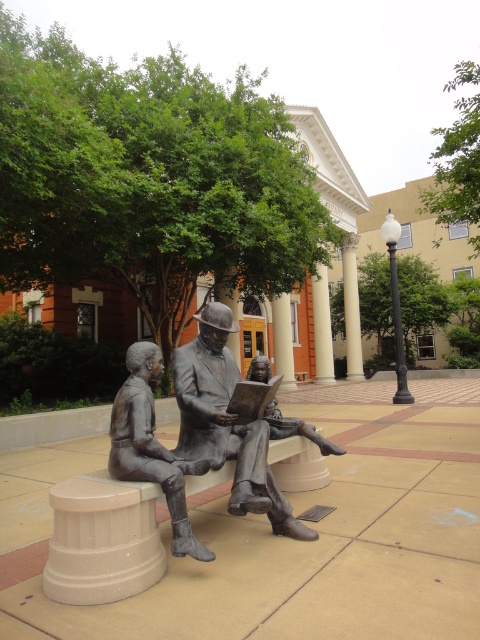
Is bronze statue of man reading at center bigger than bronze statue of man reading book at center?

Yes.

Is bronze statue of man reading at center positioned behind bronze statue of man reading book at center?

Yes, it is behind bronze statue of man reading book at center.

This screenshot has width=480, height=640. What do you see at coordinates (227, 422) in the screenshot?
I see `bronze statue of man reading at center` at bounding box center [227, 422].

You are a GUI agent. You are given a task and a screenshot of the screen. Output one action in this format:
    pyautogui.click(x=<x>, y=<y>)
    Task: Click on the bronze statue of man reading at center
    The image size is (480, 640).
    Given the screenshot: What is the action you would take?
    pyautogui.click(x=227, y=422)